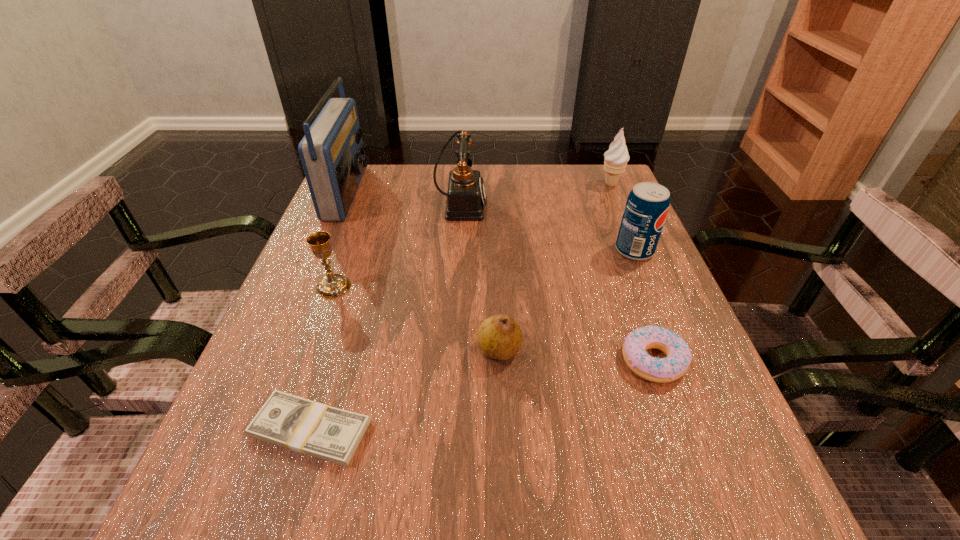
The height and width of the screenshot is (540, 960). What are the coordinates of `blank space that satisfies the following two spatial constraints: 1. on the front panel of the third shortest object; 2. on the left side of the tallest object` in the screenshot? It's located at (281, 350).

What are the coordinates of `free space that satisfies the following two spatial constraints: 1. on the front panel of the nearest object; 2. on the right side of the radio receiver` in the screenshot? It's located at (248, 430).

Locate an element on the screen. The width and height of the screenshot is (960, 540). free space that satisfies the following two spatial constraints: 1. on the front-facing side of the icecream; 2. on the front panel of the tallest object is located at coordinates (614, 192).

Where is `vacant area that satisfies the following two spatial constraints: 1. on the front panel of the doughnut; 2. on the left side of the radio receiver`? vacant area that satisfies the following two spatial constraints: 1. on the front panel of the doughnut; 2. on the left side of the radio receiver is located at coordinates (276, 361).